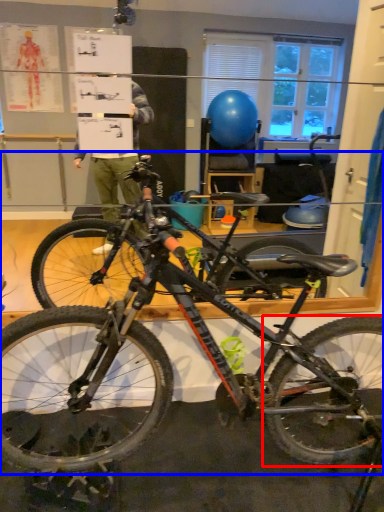
Question: Which of the following is the closest to the observer, bicycle wheel (highlighted by a red box) or bicycle (highlighted by a blue box)?

Choices:
 (A) bicycle wheel
 (B) bicycle

Answer: (B)